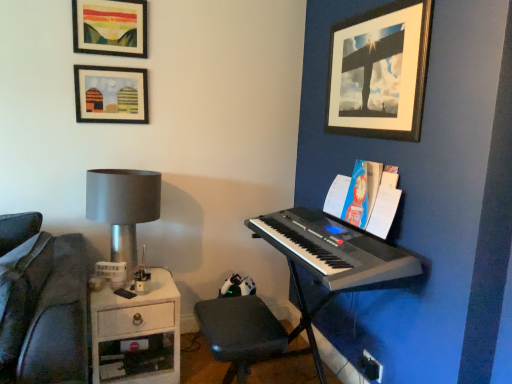
Question: Considering the positions of matte glass picture frame at upper left, acting as the second picture frame starting from the left, and silver metallic keyboard at right in the image, is matte glass picture frame at upper left, acting as the second picture frame starting from the left, taller or shorter than silver metallic keyboard at right?

Choices:
 (A) short
 (B) tall

Answer: (A)

Question: In the image, is matte glass picture frame at upper left, placed as the second picture frame when sorted from right to left, on the left side or the right side of silver metallic keyboard at right?

Choices:
 (A) left
 (B) right

Answer: (A)

Question: Estimate the real-world distances between objects in this image. Which object is farther from the black matte step stool at lower center?

Choices:
 (A) blue paper at right
 (B) matte glass picture frame at upper left, acting as the second picture frame starting from the left
 (C) matte black picture frame at upper left, which is the third picture frame from right to left
 (D) white glossy drawer at lower left
 (E) black plastic keyboard at right

Answer: (B)

Question: Estimate the real-world distances between objects in this image. Which object is closer to the silver metallic keyboard at right?

Choices:
 (A) black matte step stool at lower center
 (B) black plastic keyboard at right
 (C) blue paper at right
 (D) wooden picture frame at upper right, which is the third picture frame in left-to-right order
 (E) matte black picture frame at upper left, which is the third picture frame from right to left

Answer: (B)